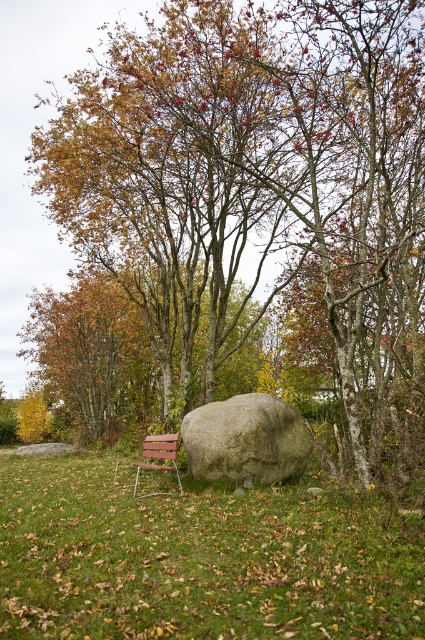
Question: Which of these objects is positioned farthest from the wooden park bench at lower left?

Choices:
 (A) gray rough boulder at center
 (B) green grassy at center
 (C) brown textured rock at center

Answer: (B)

Question: Does brown textured rock at center have a larger size compared to gray rough boulder at center?

Choices:
 (A) no
 (B) yes

Answer: (B)

Question: Among these objects, which one is farthest from the camera?

Choices:
 (A) wooden park bench at lower left
 (B) brown textured rock at center
 (C) gray rough boulder at center

Answer: (C)

Question: Does brown textured rock at center appear on the left side of green grassy at center?

Choices:
 (A) no
 (B) yes

Answer: (A)

Question: Can you confirm if green grassy at center is smaller than wooden park bench at lower left?

Choices:
 (A) no
 (B) yes

Answer: (B)

Question: Which point appears closest to the camera in this image?

Choices:
 (A) (147, 451)
 (B) (416, 614)
 (C) (340, 189)

Answer: (B)